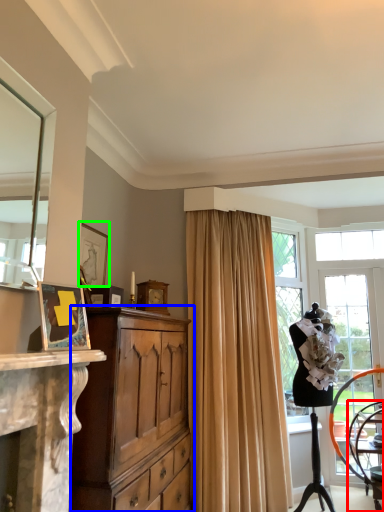
Question: Estimate the real-world distances between objects in this image. Which object is farther from chair (highlighted by a red box), cabinetry (highlighted by a blue box) or picture frame (highlighted by a green box)?

Choices:
 (A) cabinetry
 (B) picture frame

Answer: (B)